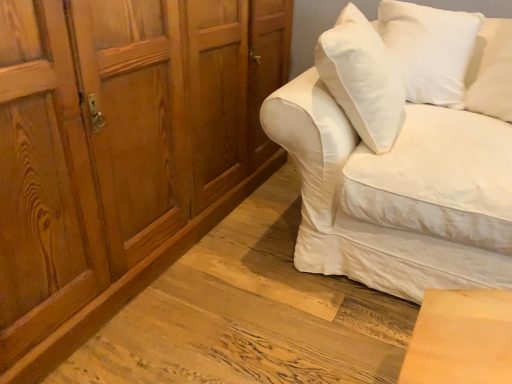
Describe the element at coordinates (398, 194) in the screenshot. The image size is (512, 384). I see `white cotton couch at right` at that location.

What is the approximate height of white soft cushion at upper right?

white soft cushion at upper right is 18.09 inches tall.

This screenshot has height=384, width=512. I want to click on white cotton couch at right, so click(x=398, y=194).

Does white soft cushion at upper right contain white cotton couch at right?

No, white cotton couch at right is located outside of white soft cushion at upper right.

Which point is more distant from viewer, (445, 50) or (414, 142)?

The point (445, 50) is farther from the camera.

In the image, is white soft cushion at upper right positioned in front of or behind white cotton couch at right?

Visually, white soft cushion at upper right is located behind white cotton couch at right.

Is the depth of white cotton couch at right greater than that of wooden cabinet at left?

Yes, it is behind wooden cabinet at left.

How many degrees apart are the facing directions of white cotton couch at right and wooden cabinet at left?

88.8 degrees.

Measure the distance between white cotton couch at right and wooden cabinet at left.

white cotton couch at right and wooden cabinet at left are 59.06 centimeters apart from each other.

From a real-world perspective, is white cotton couch at right positioned over wooden cabinet at left based on gravity?

No, from a real-world perspective, white cotton couch at right is not on top of wooden cabinet at left.

Is white cotton couch at right bigger or smaller than white soft cushion at upper right?

Considering their sizes, white cotton couch at right takes up more space than white soft cushion at upper right.

The width and height of the screenshot is (512, 384). What are the coordinates of `studio couch in front of the white soft cushion at upper right` in the screenshot? It's located at (398, 194).

Who is taller, white cotton couch at right or white soft cushion at upper right?

Standing taller between the two is white cotton couch at right.

Would you say white cotton couch at right contains white soft cushion at upper right?

Yes, white soft cushion at upper right is surrounded by white cotton couch at right.

In the image, is white soft cushion at upper right on the left side or the right side of wooden cabinet at left?

white soft cushion at upper right is positioned on wooden cabinet at left's right side.

In the scene shown: From the image's perspective, is white soft cushion at upper right located beneath wooden cabinet at left?

No.

Is wooden cabinet at left at the back of white soft cushion at upper right?

No, white soft cushion at upper right's orientation is not away from wooden cabinet at left.

Are white soft cushion at upper right and wooden cabinet at left located far from each other?

No, white soft cushion at upper right is not far away from wooden cabinet at left.

Which is behind, wooden cabinet at left or white soft cushion at upper right?

white soft cushion at upper right is further away from the camera.

From the image's perspective, which one is positioned lower, wooden cabinet at left or white soft cushion at upper right?

wooden cabinet at left.

Is wooden cabinet at left taller or shorter than white soft cushion at upper right?

In the image, wooden cabinet at left appears to be taller than white soft cushion at upper right.

Is wooden cabinet at left smaller than white soft cushion at upper right?

No, wooden cabinet at left is not smaller than white soft cushion at upper right.

From a real-world perspective, which object rests below the other?

white cotton couch at right, from a real-world perspective.

There is a white cotton couch at right. What are the coordinates of `cabinetry above it (from a real-world perspective)` in the screenshot? It's located at (121, 152).

Is wooden cabinet at left taller or shorter than white cotton couch at right?

wooden cabinet at left is taller than white cotton couch at right.

Could you tell me if wooden cabinet at left is facing white cotton couch at right?

Yes, wooden cabinet at left is facing white cotton couch at right.

In order to click on studio couch that is in front of the white soft cushion at upper right in this screenshot , I will do `click(398, 194)`.

Identify the location of cabinetry above the white cotton couch at right (from the image's perspective). (121, 152).

From the image, which object appears to be nearer to white cotton couch at right, white soft cushion at upper right or wooden cabinet at left?

white soft cushion at upper right is positioned closer to the anchor white cotton couch at right.

Which object lies further to the anchor point wooden cabinet at left, white soft cushion at upper right or white cotton couch at right?

Based on the image, white soft cushion at upper right appears to be further to wooden cabinet at left.

From the picture: From the image, which object appears to be farther from white soft cushion at upper right, white cotton couch at right or wooden cabinet at left?

wooden cabinet at left is further to white soft cushion at upper right.

Looking at the image, which one is located further to wooden cabinet at left, white cotton couch at right or white soft cushion at upper right?

white soft cushion at upper right is positioned further to the anchor wooden cabinet at left.

Looking at the image, which one is located further to white soft cushion at upper right, wooden cabinet at left or white cotton couch at right?

wooden cabinet at left is further to white soft cushion at upper right.

From the picture: Which object lies further to the anchor point white cotton couch at right, wooden cabinet at left or white soft cushion at upper right?

wooden cabinet at left.

I want to click on studio couch between wooden cabinet at left and white soft cushion at upper right in the horizontal direction, so click(398, 194).